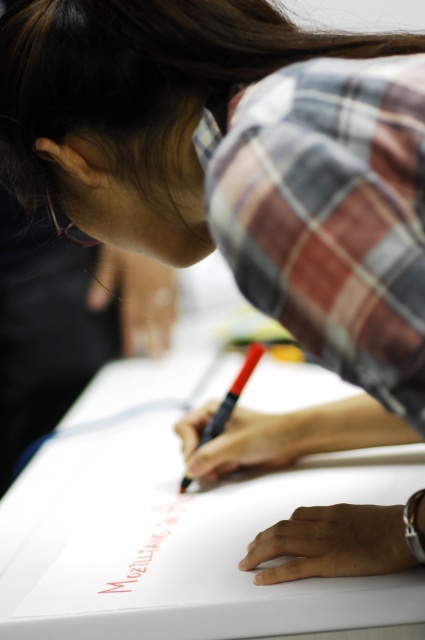
Can you confirm if pink matte marker at center is positioned to the right of black matte pen at center?

In fact, pink matte marker at center is to the left of black matte pen at center.

Can you confirm if pink matte marker at center is taller than black matte pen at center?

Incorrect, pink matte marker at center's height is not larger of black matte pen at center's.

Which is behind, point (138, 577) or point (229, 401)?

The point (229, 401) is more distant.

At what (x,y) coordinates should I click in order to perform the action: click on pink matte marker at center. Please return your answer as a coordinate pair (x, y). The image size is (425, 640). Looking at the image, I should click on (138, 545).

How distant is white paper at center from black matte pen at center?

The distance of white paper at center from black matte pen at center is 10.58 inches.

Does white paper at center appear on the left side of black matte pen at center?

Correct, you'll find white paper at center to the left of black matte pen at center.

From the picture: Who is more distant from viewer, (226, 589) or (226, 413)?

Positioned behind is point (226, 413).

Find the location of a particular element. white paper at center is located at coordinates (181, 541).

Between white paper at center and pink matte marker at center, which one has less height?

Standing shorter between the two is pink matte marker at center.

Between point (302, 369) and point (173, 515), which one is positioned in front?

Point (173, 515)

Locate an element on the screen. white paper at center is located at coordinates (181, 541).